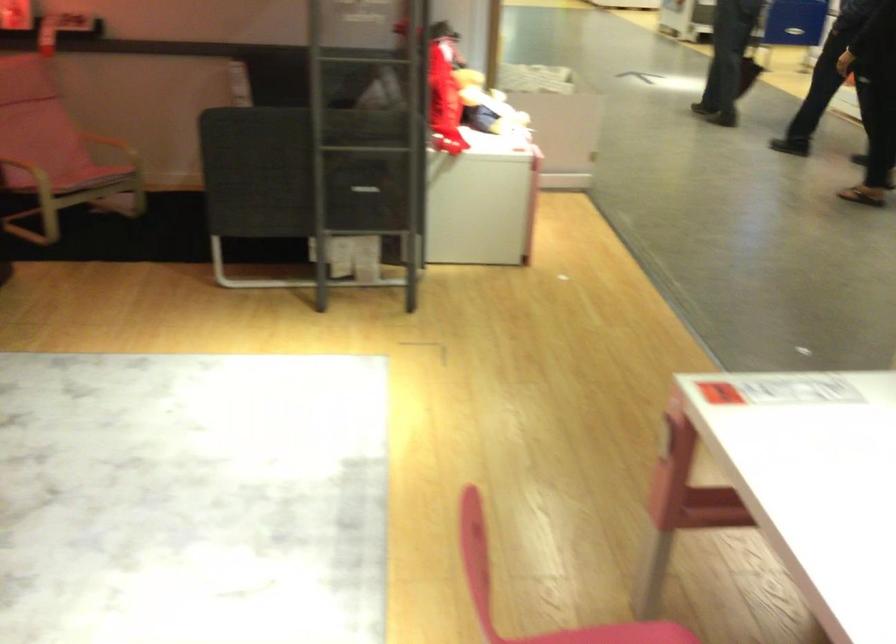
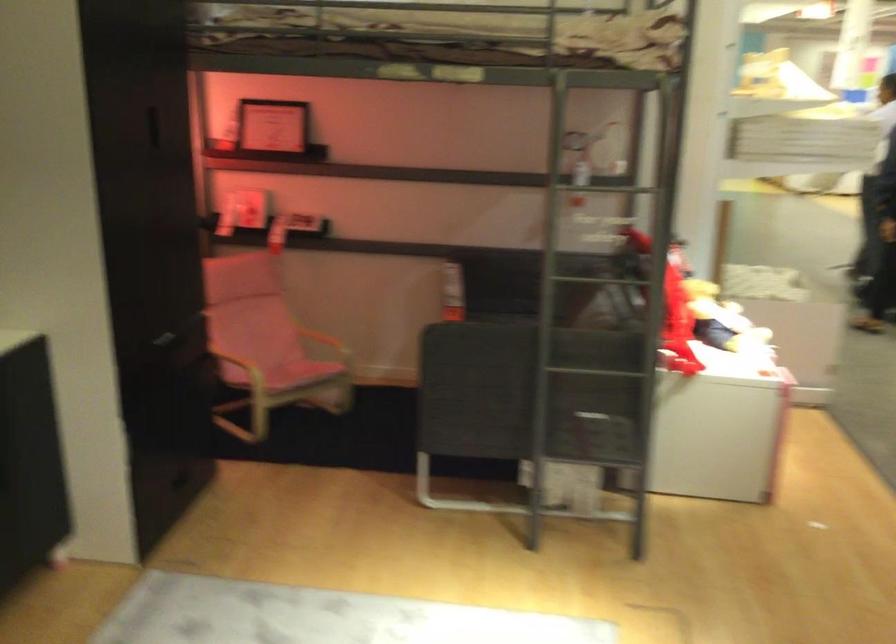
Locate, in the second image, the point that corresponds to [122,129] in the first image.

(332, 328)